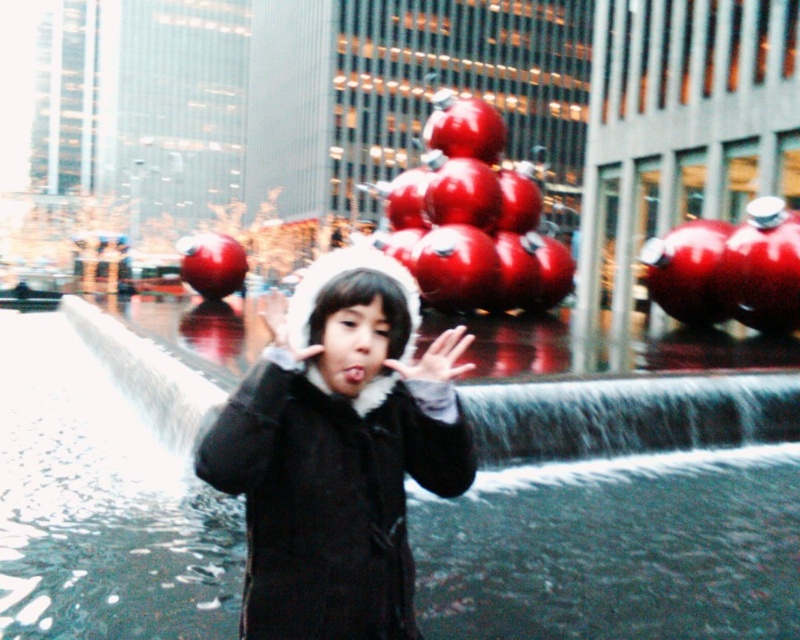
Question: Is matte black coat at center above white fluffy hand at center?

Choices:
 (A) yes
 (B) no

Answer: (B)

Question: Is matte black coat at center below white fluffy hand at center?

Choices:
 (A) yes
 (B) no

Answer: (A)

Question: Which point appears closest to the camera in this image?

Choices:
 (A) (294, 477)
 (B) (448, 348)

Answer: (A)

Question: Does matte black coat at center appear over white fluffy hand at center?

Choices:
 (A) no
 (B) yes

Answer: (A)